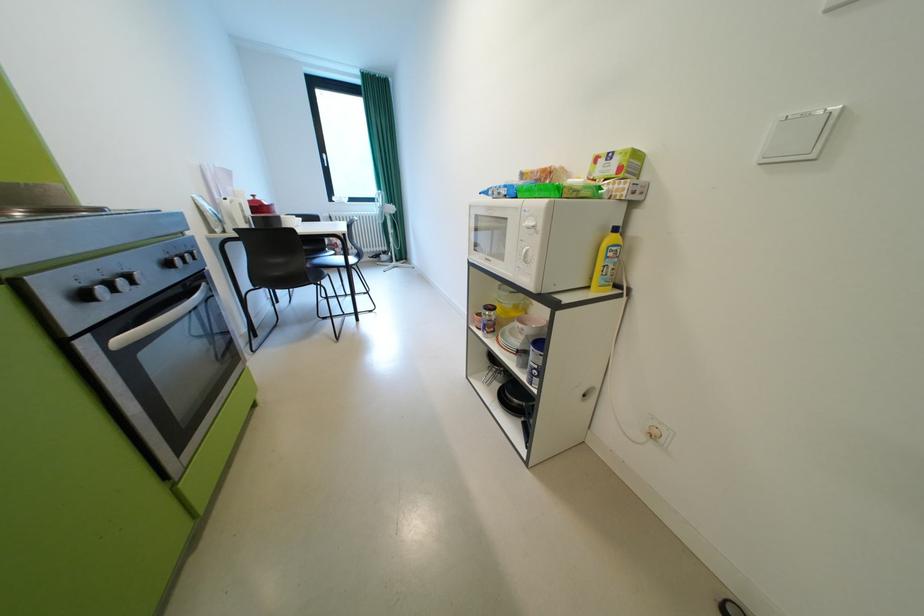
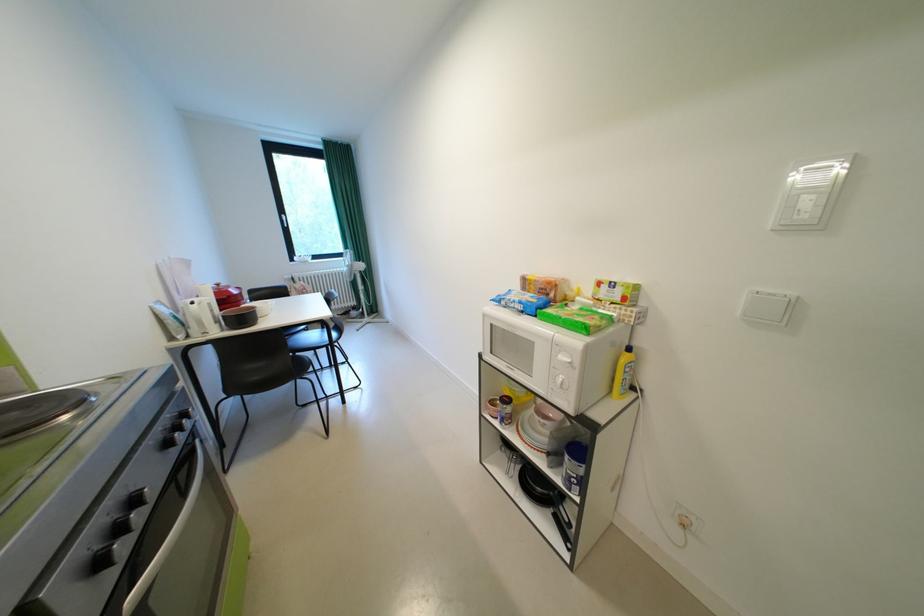
Find the pixel in the second image that matches (x=254, y=217) in the first image.

(225, 317)